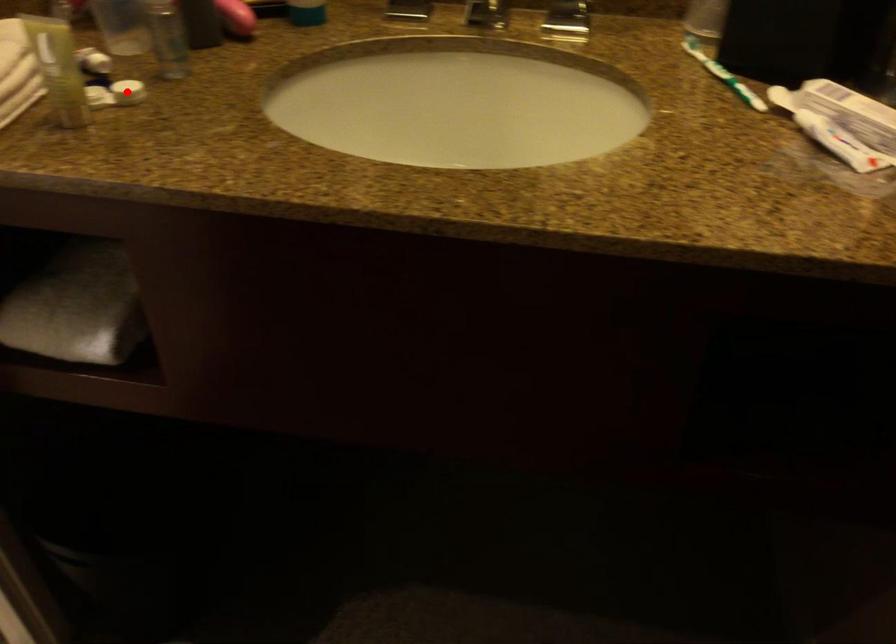
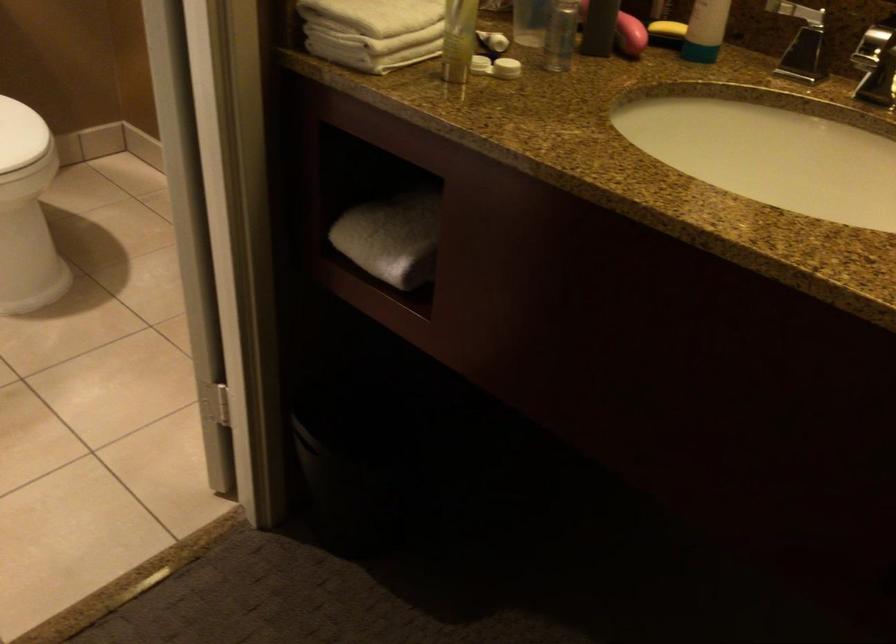
Question: I am providing you with two images of the same scene from different viewpoints. A red point is shown in image1. For the corresponding object point in image2, is it positioned nearer or farther from the camera?

Choices:
 (A) Nearer
 (B) Farther

Answer: (B)